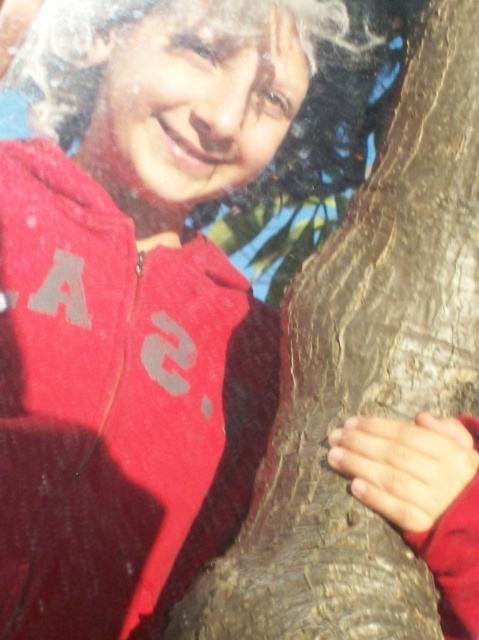
You are a photographer trying to capture the scene with the matte red jacket at left and the curly blonde hair at upper left. Which object should you focus on first if you want to ensure both are in frame without moving the camera?

The matte red jacket at left is positioned on the left side of curly blonde hair at upper left, so you should focus on the matte red jacket at left first to ensure both are in frame without moving the camera.

Looking at this image, you are a photographer trying to capture the scene where the person is touching the tree. You want to ensure that both the matte red jacket at left and the curly blonde hair at upper left are visible in the frame. Based on their positions, which object should you focus on first to make sure both are in the shot?

The matte red jacket at left is positioned under the curly blonde hair at upper left. To ensure both are visible, focus on the curly blonde hair at upper left first since it is higher up, allowing the jacket below it to naturally fall into the frame.

You are a photographer trying to capture the person touching the tree trunk. Since the matte red jacket at left and curly blonde hair at upper left are both in your viewfinder, which one is closer to the camera?

The matte red jacket at left is closer to the camera because it is in front of the curly blonde hair at upper left.